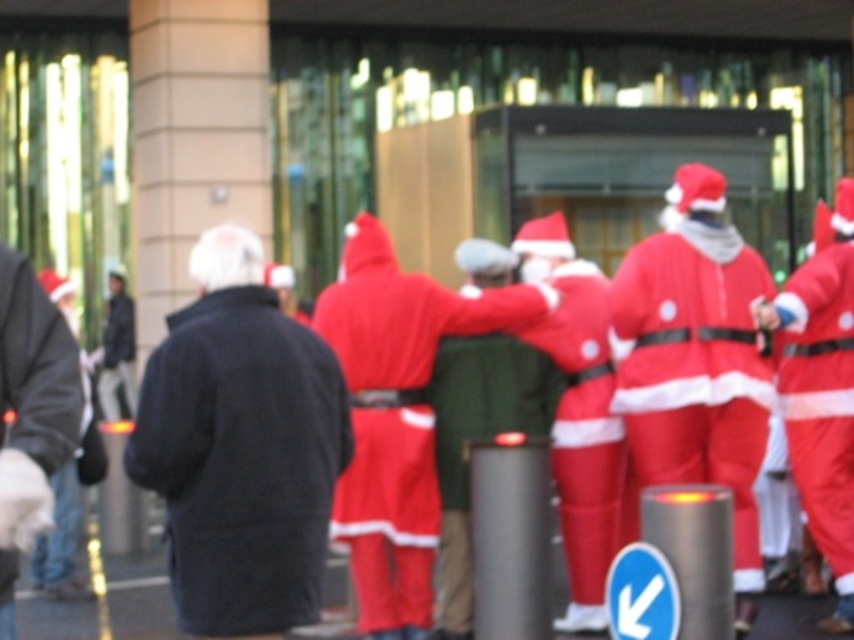
You are a photographer trying to capture both the velvet red santa suit at center and the matte red santa at right in a single frame. Which Santa costume should you focus on first to ensure both are in the frame?

The velvet red santa suit at center is smaller than the matte red santa at right, so you should focus on the matte red santa at right first to ensure both are in the frame.

You are a photographer trying to capture a group photo of the matte red santa at center and the matte red santa at right. You want to ensure both are in focus. Given that your camera can only focus on one height at a time, which Santa should you focus on to include both in the frame?

The matte red santa at center is not as tall as the matte red santa at right. To include both in focus, you should focus on the matte red santa at right since it is taller, ensuring the shorter one at center will also be within the depth of field.